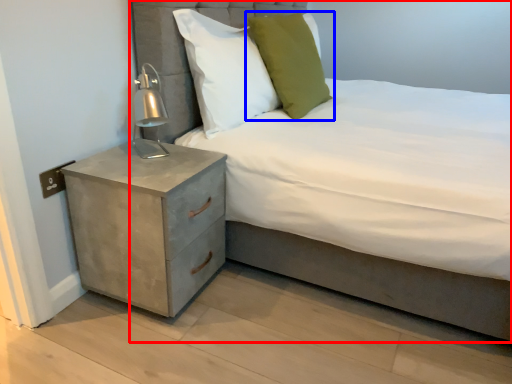
Question: Which object appears farthest to the camera in this image, bed (highlighted by a red box) or pillow (highlighted by a blue box)?

Choices:
 (A) bed
 (B) pillow

Answer: (B)